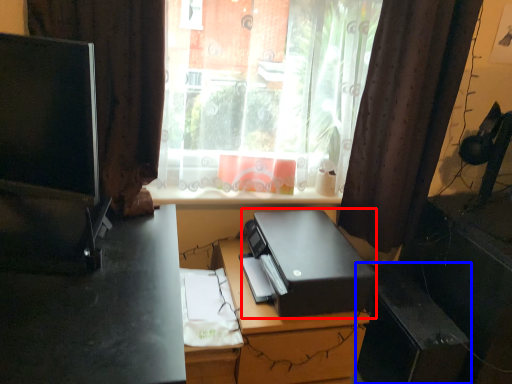
Question: Which object appears farthest to the camera in this image, printer (highlighted by a red box) or file cabinet (highlighted by a blue box)?

Choices:
 (A) printer
 (B) file cabinet

Answer: (B)